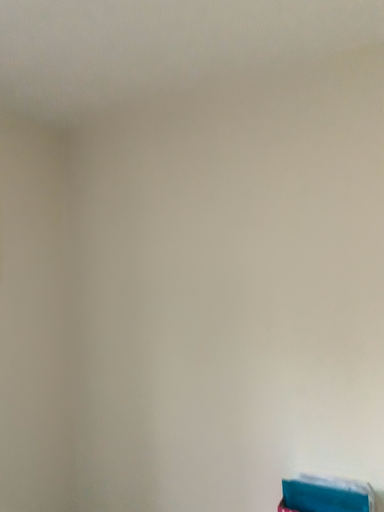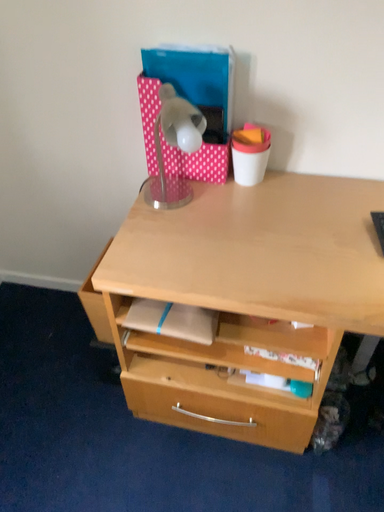
Question: Which way did the camera rotate in the video?

Choices:
 (A) rotated right
 (B) rotated left

Answer: (A)